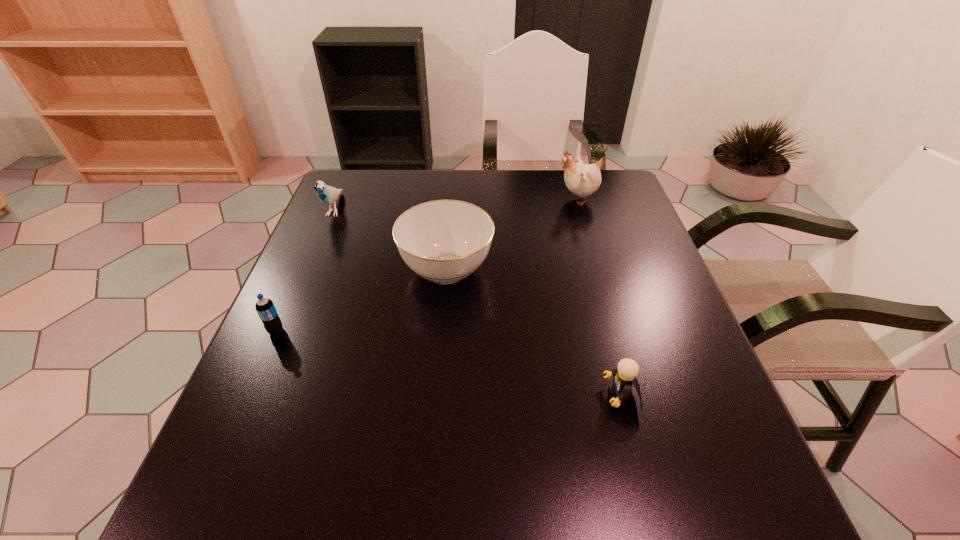
Image resolution: width=960 pixels, height=540 pixels. In order to click on blank area located on the front of the third object from left to right in this screenshot , I will do `click(443, 320)`.

This screenshot has height=540, width=960. I want to click on vacant space located 0.390m on the right of the soda bottle, so (x=469, y=331).

Image resolution: width=960 pixels, height=540 pixels. I want to click on vacant region located 0.150m on the front-facing side of the nearest object, so click(x=522, y=397).

Identify the location of blank area located on the front-facing side of the nearest object. The image size is (960, 540). (458, 397).

Image resolution: width=960 pixels, height=540 pixels. Identify the location of vacant position located on the front-facing side of the nearest object. click(x=414, y=397).

Image resolution: width=960 pixels, height=540 pixels. I want to click on bird situated at the left edge, so click(x=327, y=194).

This screenshot has height=540, width=960. I want to click on soda bottle at the left edge, so click(x=265, y=308).

At what (x,y) coordinates should I click in order to perform the action: click on bird at the right edge. Please return your answer as a coordinate pair (x, y). Looking at the image, I should click on (581, 179).

I want to click on Lego that is positioned at the right edge, so click(x=625, y=375).

The height and width of the screenshot is (540, 960). I want to click on object that is at the far left corner, so click(x=327, y=194).